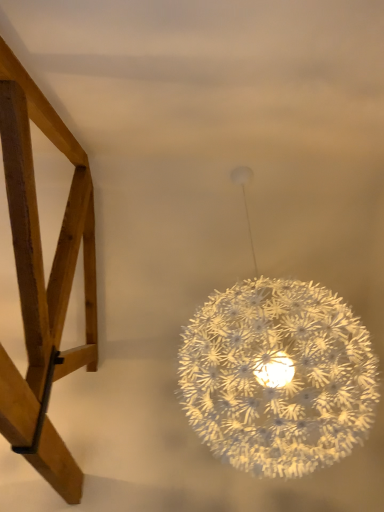
Question: Which is correct: white textured sphere at upper center is inside wooden chair at left, or outside of it?

Choices:
 (A) outside
 (B) inside

Answer: (A)

Question: Is point (235, 413) closer or farther from the camera than point (23, 243)?

Choices:
 (A) farther
 (B) closer

Answer: (A)

Question: Is white textured sphere at upper center bigger or smaller than wooden chair at left?

Choices:
 (A) small
 (B) big

Answer: (B)

Question: Is wooden chair at left to the left or to the right of white textured sphere at upper center in the image?

Choices:
 (A) right
 (B) left

Answer: (B)

Question: From the image's perspective, is wooden chair at left above or below white textured sphere at upper center?

Choices:
 (A) below
 (B) above

Answer: (B)

Question: Considering the positions of wooden chair at left and white textured sphere at upper center in the image, is wooden chair at left taller or shorter than white textured sphere at upper center?

Choices:
 (A) short
 (B) tall

Answer: (A)

Question: Is wooden chair at left inside or outside of white textured sphere at upper center?

Choices:
 (A) inside
 (B) outside

Answer: (B)